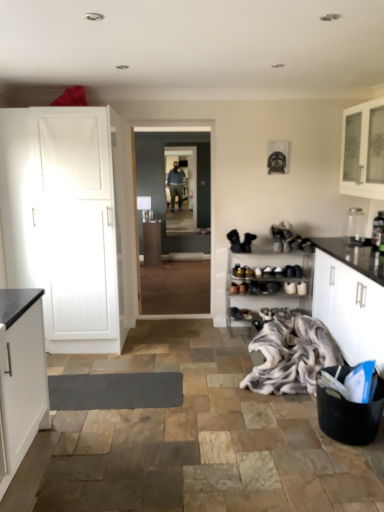
Question: Is black woven basket at lower right at the back of transparent glass door at center?

Choices:
 (A) no
 (B) yes

Answer: (A)

Question: Is transparent glass door at center beside black woven basket at lower right?

Choices:
 (A) no
 (B) yes

Answer: (A)

Question: Can we say transparent glass door at center lies outside black woven basket at lower right?

Choices:
 (A) no
 (B) yes

Answer: (B)

Question: Is there a large distance between transparent glass door at center and black woven basket at lower right?

Choices:
 (A) yes
 (B) no

Answer: (A)

Question: Does transparent glass door at center have a lesser height compared to black woven basket at lower right?

Choices:
 (A) no
 (B) yes

Answer: (A)

Question: Is point (155, 224) closer or farther from the camera than point (374, 241)?

Choices:
 (A) farther
 (B) closer

Answer: (A)

Question: In the image, is matte wood cabinet at center, the 3th cabinetry viewed from the right, on the left side or the right side of metallic silver toaster at right, the first appliance from the front?

Choices:
 (A) left
 (B) right

Answer: (A)

Question: Considering their positions, is matte wood cabinet at center, marked as the 1th cabinetry in a back-to-front arrangement, located in front of or behind metallic silver toaster at right, the second appliance in the back-to-front sequence?

Choices:
 (A) behind
 (B) front

Answer: (A)

Question: From their relative heights in the image, would you say matte wood cabinet at center, which ranks as the 3th cabinetry in front-to-back order, is taller or shorter than metallic silver toaster at right, the first appliance from the front?

Choices:
 (A) tall
 (B) short

Answer: (A)

Question: Considering the positions of fluffy white blanket at lower right and clear glass jar at upper right, which is the 2th appliance from front to back, in the image, is fluffy white blanket at lower right taller or shorter than clear glass jar at upper right, which is the 2th appliance from front to back,?

Choices:
 (A) short
 (B) tall

Answer: (A)

Question: Looking at their shapes, would you say fluffy white blanket at lower right is wider or thinner than clear glass jar at upper right, which is the 2th appliance from front to back?

Choices:
 (A) thin
 (B) wide

Answer: (B)

Question: Is fluffy white blanket at lower right inside or outside of clear glass jar at upper right, the 1th appliance from the back?

Choices:
 (A) outside
 (B) inside

Answer: (A)

Question: From a real-world perspective, is fluffy white blanket at lower right positioned above or below clear glass jar at upper right, the 1th appliance from the back?

Choices:
 (A) below
 (B) above

Answer: (A)

Question: Based on their sizes in the image, would you say matte wood cabinet at center, which ranks as the 3th cabinetry in front-to-back order, is bigger or smaller than black woven basket at lower right?

Choices:
 (A) big
 (B) small

Answer: (A)

Question: From a real-world perspective, is matte wood cabinet at center, the 2th cabinetry ordered from the bottom, above or below black woven basket at lower right?

Choices:
 (A) below
 (B) above

Answer: (B)